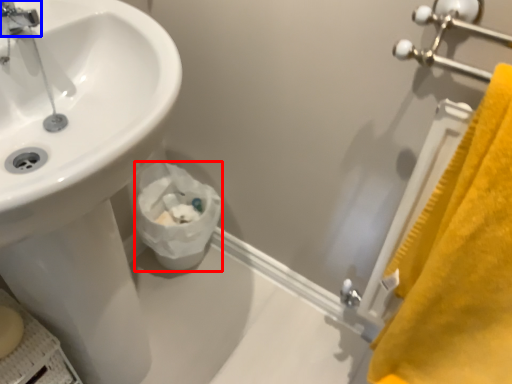
Question: Which of the following is the farthest to the observer, toilet paper (highlighted by a red box) or tap (highlighted by a blue box)?

Choices:
 (A) toilet paper
 (B) tap

Answer: (A)